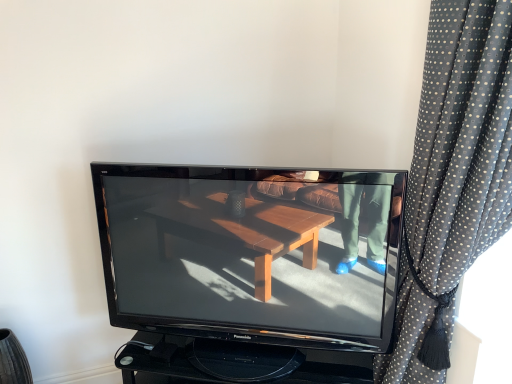
At what (x,y) coordinates should I click in order to perform the action: click on black dotted fabric at right. Please return your answer as a coordinate pair (x, y). The width and height of the screenshot is (512, 384). Looking at the image, I should click on (453, 173).

This screenshot has height=384, width=512. What do you see at coordinates (453, 173) in the screenshot?
I see `black dotted fabric at right` at bounding box center [453, 173].

What is the approximate width of black dotted fabric at right?

black dotted fabric at right is 18.94 inches wide.

Where is `black glossy television at center`? The height and width of the screenshot is (384, 512). black glossy television at center is located at coordinates (243, 266).

Image resolution: width=512 pixels, height=384 pixels. What do you see at coordinates (243, 266) in the screenshot?
I see `black glossy television at center` at bounding box center [243, 266].

Where is `black dotted fabric at right`? black dotted fabric at right is located at coordinates (453, 173).

Would you say black dotted fabric at right is to the left or to the right of black glossy television at center in the picture?

Clearly, black dotted fabric at right is on the right of black glossy television at center in the image.

Which object is further away from the camera taking this photo, black dotted fabric at right or black glossy television at center?

black glossy television at center is behind.

Is point (439, 162) closer or farther from the camera than point (206, 193)?

Point (439, 162) is positioned closer to the camera compared to point (206, 193).

Looking at this image, from the image's perspective, is black dotted fabric at right located above black glossy television at center?

Yes, from the image's perspective, black dotted fabric at right is above black glossy television at center.

From a real-world perspective, which is physically above, black dotted fabric at right or black glossy television at center?

In real-world perspective, black dotted fabric at right is above.

Considering the sizes of black dotted fabric at right and black glossy television at center in the image, is black dotted fabric at right wider or thinner than black glossy television at center?

Considering their sizes, black dotted fabric at right looks broader than black glossy television at center.

Which of these two, black dotted fabric at right or black glossy television at center, stands shorter?

→ Standing shorter between the two is black glossy television at center.

Can you confirm if black dotted fabric at right is bigger than black glossy television at center?

Indeed, black dotted fabric at right has a larger size compared to black glossy television at center.

Can black glossy television at center be found inside black dotted fabric at right?

That's incorrect, black glossy television at center is not inside black dotted fabric at right.

Can you see black dotted fabric at right touching black glossy television at center?

No, black dotted fabric at right is not making contact with black glossy television at center.

Is black dotted fabric at right facing towards black glossy television at center?

No, black dotted fabric at right is not oriented towards black glossy television at center.

How different are the orientations of black dotted fabric at right and black glossy television at center in degrees?

They differ by 16.4 degrees in their facing directions.

Image resolution: width=512 pixels, height=384 pixels. What are the coordinates of `curtain located on the right of black glossy television at center` in the screenshot? It's located at (453, 173).

Between black glossy television at center and black dotted fabric at right, which one appears on the left side from the viewer's perspective?

Positioned to the left is black glossy television at center.

Which object is closer to the camera, black glossy television at center or black dotted fabric at right?

black dotted fabric at right.

Is point (199, 267) farther from camera compared to point (445, 37)?

Yes, it is.

From the image's perspective, is black glossy television at center beneath black dotted fabric at right?

Correct, black glossy television at center appears lower than black dotted fabric at right in the image.

Consider the image. From a real-world perspective, does black glossy television at center stand above black dotted fabric at right?

Incorrect, from a real-world perspective, black glossy television at center is lower than black dotted fabric at right.

Considering the relative sizes of black glossy television at center and black dotted fabric at right in the image provided, is black glossy television at center thinner than black dotted fabric at right?

Indeed, black glossy television at center has a lesser width compared to black dotted fabric at right.

Is black glossy television at center taller than black dotted fabric at right?

In fact, black glossy television at center may be shorter than black dotted fabric at right.

Who is bigger, black glossy television at center or black dotted fabric at right?

black dotted fabric at right is bigger.

Would you say black glossy television at center is inside or outside black dotted fabric at right?

black glossy television at center is outside black dotted fabric at right.

Is black glossy television at center placed right next to black dotted fabric at right?

There is a gap between black glossy television at center and black dotted fabric at right.

Is black glossy television at center aimed at black dotted fabric at right?

No, black glossy television at center is not aimed at black dotted fabric at right.

Find the location of `television on the left of black dotted fabric at right`. television on the left of black dotted fabric at right is located at coordinates (243, 266).

There is a black glossy television at center. Identify the location of curtain above it (from a real-world perspective). (453, 173).

Image resolution: width=512 pixels, height=384 pixels. Identify the location of television below the black dotted fabric at right (from the image's perspective). (243, 266).